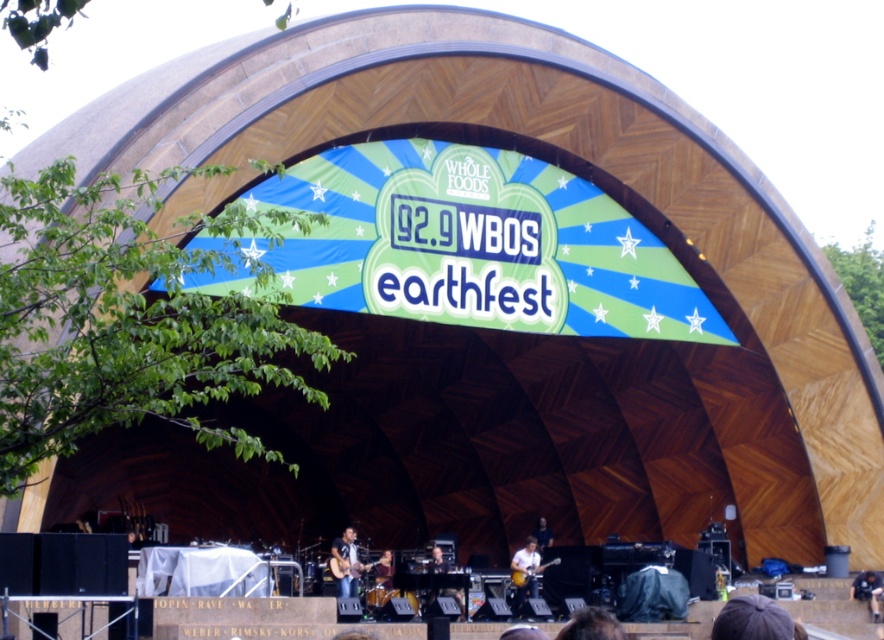
You are standing at the point marked at coordinate point (528,593) on the stage. The nearest exit is 205.54 feet away. If you need to evacuate quickly, which direction should you head towards to reach the nearest exit?

The nearest exit is 205.54 feet away from the point marked at coordinate point (528,593). Since the exit is the closest, you should head towards the direction leading to the nearest exit.

You are a photographer at Earthfest capturing the stage setup. You notice the matte white guitar at center and the dark blue jeans at lower right. From the audience perspective, which object appears higher in the image?

The matte white guitar at center appears higher than the dark blue jeans at lower right because it is located above it.

You are standing on the stage at Earthfest and notice the dark blue jeans at lower right. Where exactly are they positioned relative to the stage?

The dark blue jeans at lower right are located at point coordinates of (867,589) on the stage.